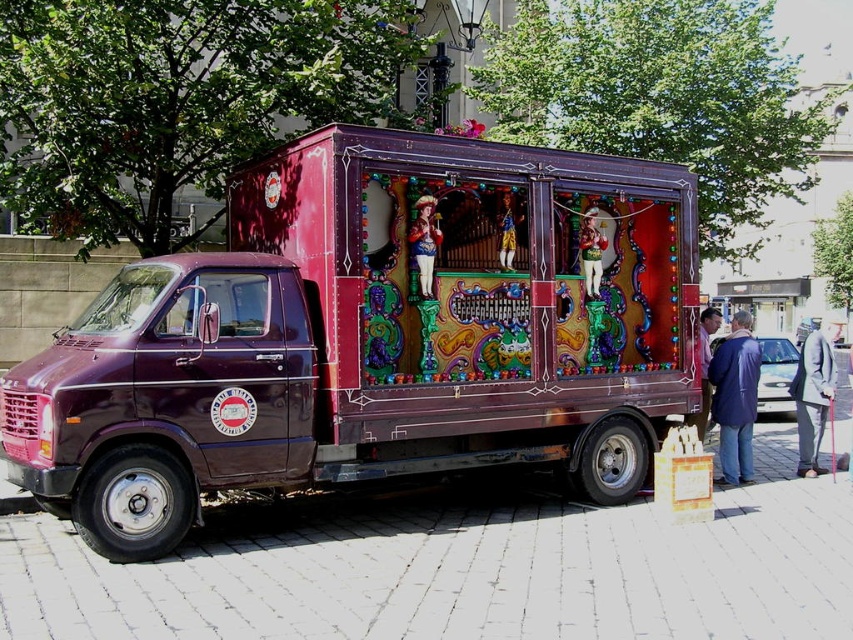
Question: Can you confirm if matte gold statue at center is positioned above matte gold figurine at center?

Choices:
 (A) no
 (B) yes

Answer: (A)

Question: Which point is closer to the camera?

Choices:
 (A) blue leather jacket at lower right
 (B) gray suit at right
 (C) matte gold statue at center

Answer: (C)

Question: Observing the image, what is the correct spatial positioning of shiny purple truck at center in reference to matte gold figurine at center?

Choices:
 (A) left
 (B) right

Answer: (B)

Question: Which is farther from the blue leather jacket at lower right?

Choices:
 (A) smooth wooden figure at center
 (B) matte gold statue at center
 (C) light brown leather jacket at lower right
 (D) shiny purple truck at center

Answer: (B)

Question: Which of the following is the farthest from the observer?

Choices:
 (A) matte gold figurine at center
 (B) shiny purple truck at center
 (C) matte gold statue at center

Answer: (A)

Question: Is shiny purple truck at center in front of blue leather jacket at lower right?

Choices:
 (A) no
 (B) yes

Answer: (B)